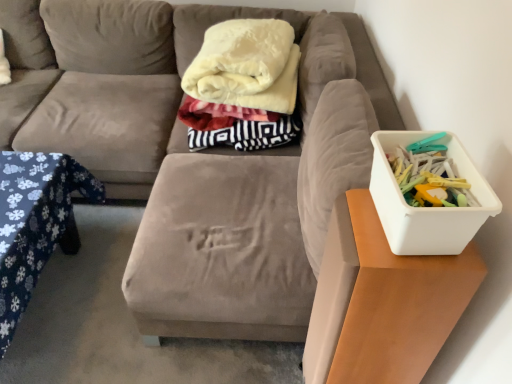
Question: From a real-world perspective, is white plastic container at right below velvet beige couch at center?

Choices:
 (A) yes
 (B) no

Answer: (B)

Question: Is white plastic container at right at the right side of velvet beige couch at center?

Choices:
 (A) yes
 (B) no

Answer: (A)

Question: From the image's perspective, is white plastic container at right on velvet beige couch at center?

Choices:
 (A) yes
 (B) no

Answer: (B)

Question: Is white plastic container at right far away from velvet beige couch at center?

Choices:
 (A) no
 (B) yes

Answer: (A)

Question: Can you confirm if white plastic container at right is bigger than velvet beige couch at center?

Choices:
 (A) yes
 (B) no

Answer: (B)

Question: From a real-world perspective, is blue fabric table at lower left, marked as the 1th table in a left-to-right arrangement, physically located above or below velvet beige couch at center?

Choices:
 (A) above
 (B) below

Answer: (B)

Question: Is blue fabric table at lower left, marked as the 1th table in a left-to-right arrangement, in front of or behind velvet beige couch at center in the image?

Choices:
 (A) behind
 (B) front

Answer: (A)

Question: Is blue fabric table at lower left, marked as the 1th table in a left-to-right arrangement, bigger or smaller than velvet beige couch at center?

Choices:
 (A) big
 (B) small

Answer: (B)

Question: Do you think blue fabric table at lower left, the 2th table viewed from the right, is within velvet beige couch at center, or outside of it?

Choices:
 (A) inside
 (B) outside

Answer: (A)

Question: Is soft cream fleece blanket at center inside the boundaries of blue fabric table at lower left, marked as the 1th table in a left-to-right arrangement, or outside?

Choices:
 (A) inside
 (B) outside

Answer: (B)

Question: Considering the relative positions of soft cream fleece blanket at center and blue fabric table at lower left, the 2th table viewed from the right, in the image provided, is soft cream fleece blanket at center to the left or to the right of blue fabric table at lower left, the 2th table viewed from the right,?

Choices:
 (A) right
 (B) left

Answer: (A)

Question: From a real-world perspective, relative to blue fabric table at lower left, marked as the 1th table in a left-to-right arrangement, is soft cream fleece blanket at center vertically above or below?

Choices:
 (A) below
 (B) above

Answer: (B)

Question: Is soft cream fleece blanket at center bigger or smaller than blue fabric table at lower left, the 2th table viewed from the right?

Choices:
 (A) big
 (B) small

Answer: (A)

Question: From a real-world perspective, is velvet beige couch at center physically located above or below white plastic container at right, which is counted as the first table, starting from the right?

Choices:
 (A) below
 (B) above

Answer: (A)

Question: In terms of width, does velvet beige couch at center look wider or thinner when compared to white plastic container at right, which is counted as the first table, starting from the right?

Choices:
 (A) wide
 (B) thin

Answer: (A)